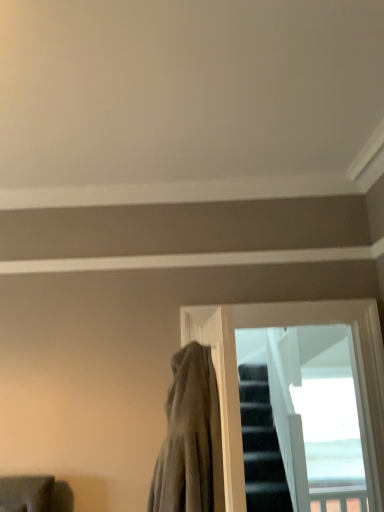
Question: Is gray cotton cloak at center not near transparent glass window at center?

Choices:
 (A) yes
 (B) no

Answer: (B)

Question: From the image's perspective, is gray cotton cloak at center on top of transparent glass window at center?

Choices:
 (A) no
 (B) yes

Answer: (B)

Question: Is gray cotton cloak at center positioned with its back to transparent glass window at center?

Choices:
 (A) no
 (B) yes

Answer: (B)

Question: Considering the relative sizes of gray cotton cloak at center and transparent glass window at center in the image provided, is gray cotton cloak at center bigger than transparent glass window at center?

Choices:
 (A) yes
 (B) no

Answer: (A)

Question: Can you confirm if gray cotton cloak at center is thinner than transparent glass window at center?

Choices:
 (A) no
 (B) yes

Answer: (A)

Question: Can you confirm if gray cotton cloak at center is smaller than transparent glass window at center?

Choices:
 (A) yes
 (B) no

Answer: (B)

Question: Can you confirm if transparent glass window at center is smaller than gray cotton cloak at center?

Choices:
 (A) no
 (B) yes

Answer: (B)

Question: Is transparent glass window at center surrounding gray cotton cloak at center?

Choices:
 (A) no
 (B) yes

Answer: (A)

Question: From the image's perspective, is transparent glass window at center on top of gray cotton cloak at center?

Choices:
 (A) yes
 (B) no

Answer: (B)

Question: Is transparent glass window at center completely or partially outside of gray cotton cloak at center?

Choices:
 (A) yes
 (B) no

Answer: (A)

Question: Is transparent glass window at center wider than gray cotton cloak at center?

Choices:
 (A) yes
 (B) no

Answer: (B)

Question: Is transparent glass window at center turned away from gray cotton cloak at center?

Choices:
 (A) yes
 (B) no

Answer: (B)

Question: Is gray cotton cloak at center wider or thinner than transparent glass window at center?

Choices:
 (A) thin
 (B) wide

Answer: (B)